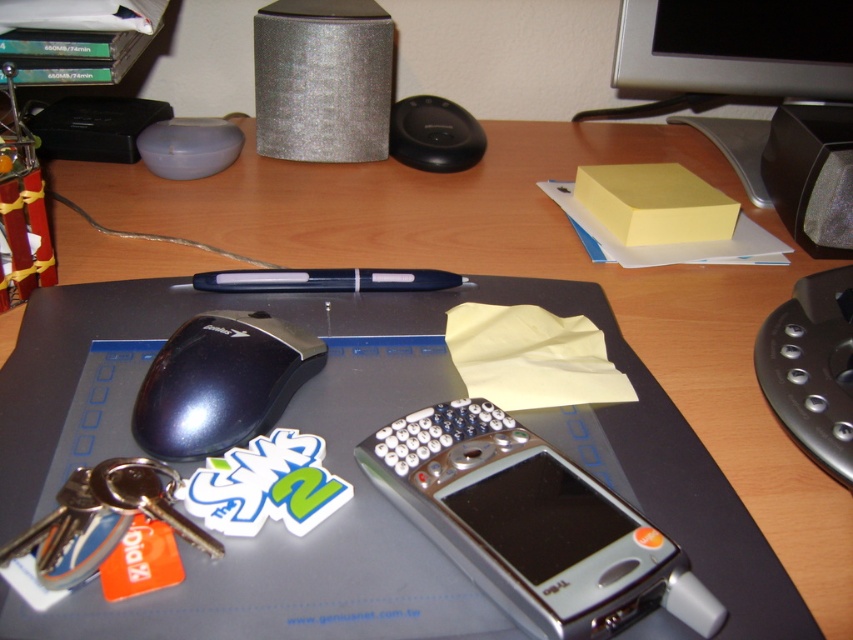
You are organizing the desk and want to place a new item at point (322, 80). What object is currently located there?

The silver glittery speaker at upper center is located at point (322, 80).